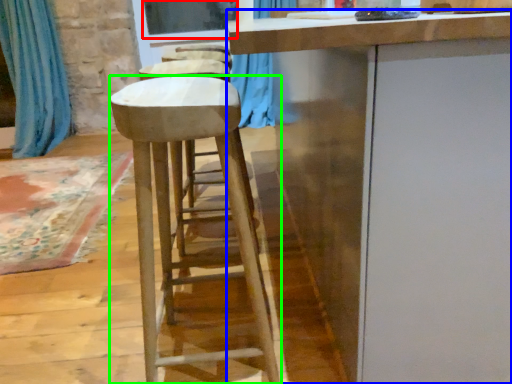
Question: Which object is the closest to the window screen (highlighted by a red box)? Choose among these: cabinetry (highlighted by a blue box) or stool (highlighted by a green box).

Choices:
 (A) cabinetry
 (B) stool

Answer: (B)